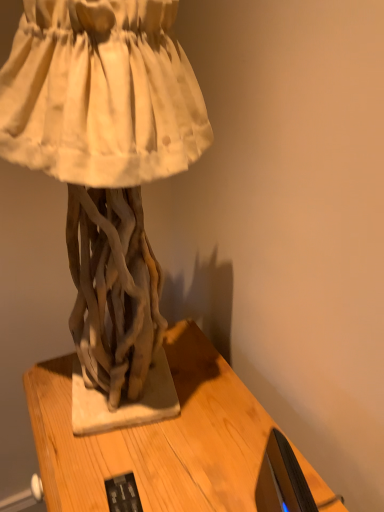
Question: Is wooden table at center to the left or to the right of matte driftwood sculpture at center in the image?

Choices:
 (A) right
 (B) left

Answer: (A)

Question: Choose the correct answer: Is wooden table at center inside matte driftwood sculpture at center or outside it?

Choices:
 (A) outside
 (B) inside

Answer: (A)

Question: Estimate the real-world distances between objects in this image. Which object is closer to the wooden table at center?

Choices:
 (A) black glossy monitor at lower right
 (B) matte driftwood sculpture at center

Answer: (A)

Question: Considering the real-world distances, which object is farthest from the black glossy monitor at lower right?

Choices:
 (A) wooden table at center
 (B) matte driftwood sculpture at center

Answer: (B)